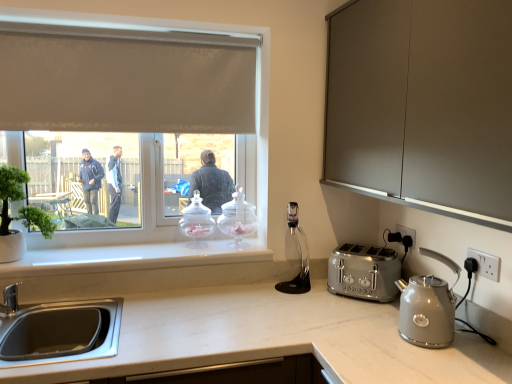
Question: Would you say green matte plant at left is to the left or to the right of black plastic electric outlet at lower right, which ranks as the first electric outlet in left-to-right order, in the picture?

Choices:
 (A) left
 (B) right

Answer: (A)

Question: Is green matte plant at left bigger or smaller than black plastic electric outlet at lower right, which ranks as the first electric outlet in left-to-right order?

Choices:
 (A) big
 (B) small

Answer: (A)

Question: Which is farther from the green matte plant at left?

Choices:
 (A) white plastic electric outlet at right, marked as the second electric outlet in a back-to-front arrangement
 (B) clear glass jar at window, placed as the 2th kitchen appliance when sorted from back to front
 (C) matte gray cabinet at upper right
 (D) black plastic electric outlet at lower right, which ranks as the 1th electric outlet in back-to-front order
 (E) white fabric window at upper left

Answer: (A)

Question: Which object is the farthest from the satin silver toaster at right?

Choices:
 (A) black plastic electric outlet at lower right, placed as the second electric outlet when sorted from front to back
 (B) green matte plant at left
 (C) matte gray cabinet at upper right
 (D) matte silver kettle at right, placed as the 3th kitchen appliance when sorted from back to front
 (E) white plastic electric outlet at right, which is the second electric outlet in left-to-right order

Answer: (B)